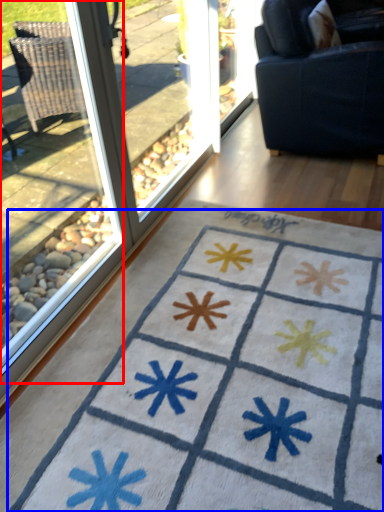
Question: Which point is further to the camera, window (highlighted by a red box) or doormat (highlighted by a blue box)?

Choices:
 (A) window
 (B) doormat

Answer: (B)